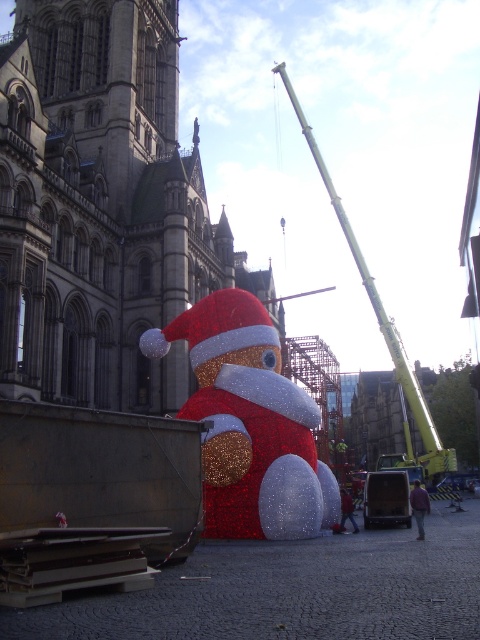
You are an observer standing in the courtyard looking towards the stone building. Which crane, the green metallic crane at upper right or the metallic yellow crane at center, is positioned higher in the scene?

The green metallic crane at upper right is positioned higher because it is above the metallic yellow crane at center.

You are standing in the public square and want to take a photo of the stone tower at center. Where should you position yourself to capture the entire structure in your camera frame?

To capture the entire stone tower at center in your camera frame, position yourself at a distance that allows the tower to fit within the viewfinder. Since the stone tower at center is located at point (100, 205), you should adjust your position accordingly to ensure the entire structure is visible.

You are an engineer assessing the installation of the Santa figure. You need to choose a crane that can reach higher to secure the Santa figure properly. Which crane should you select between the green metallic crane at upper right and the metallic yellow crane at center?

The green metallic crane at upper right is much taller than the metallic yellow crane at center, so you should select the green metallic crane at upper right to secure the Santa figure properly.